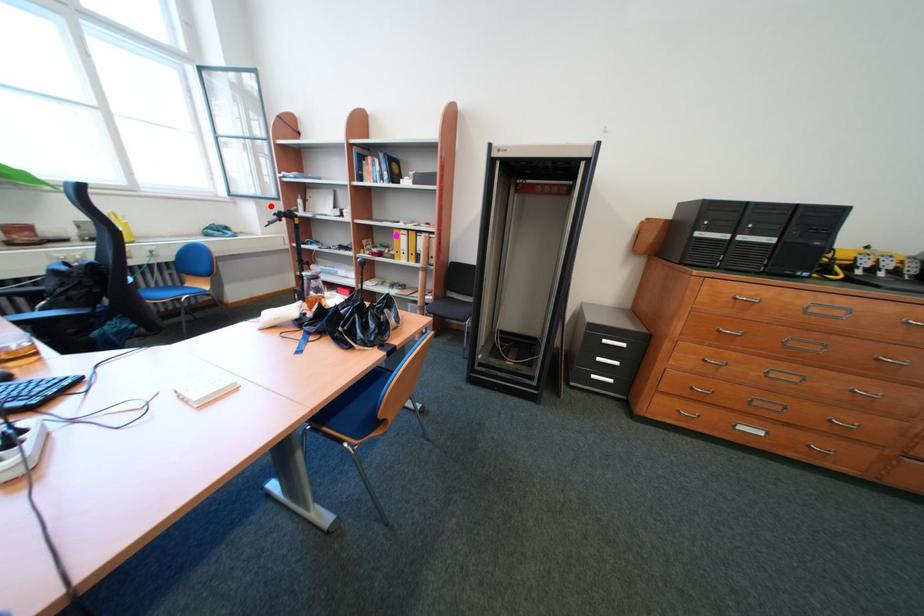
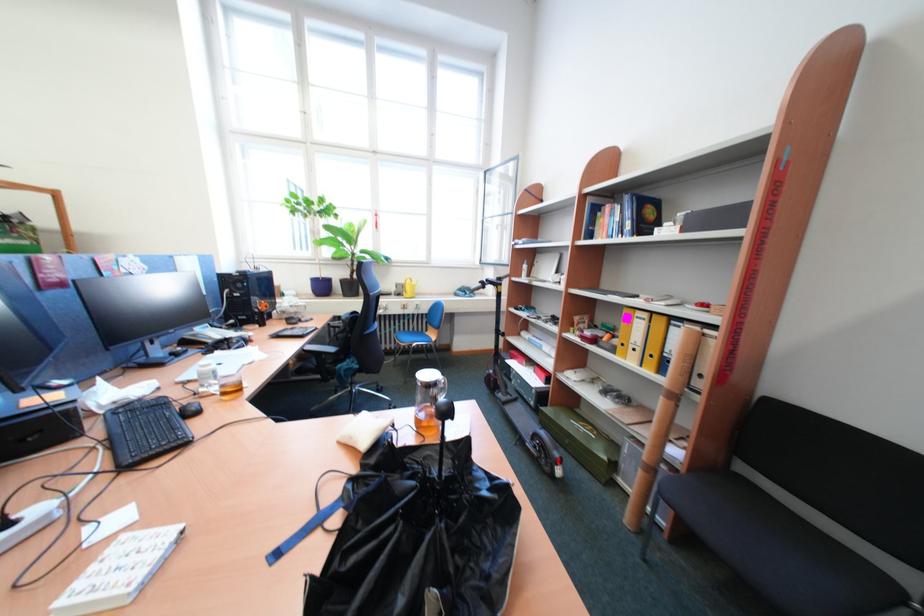
The point at the highlighted location is marked in the first image. Where is the corresponding point in the second image?

(508, 272)